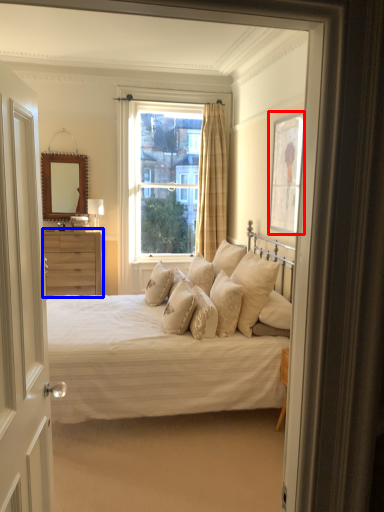
Question: Among these objects, which one is farthest to the camera, picture frame (highlighted by a red box) or chest of drawers (highlighted by a blue box)?

Choices:
 (A) picture frame
 (B) chest of drawers

Answer: (B)